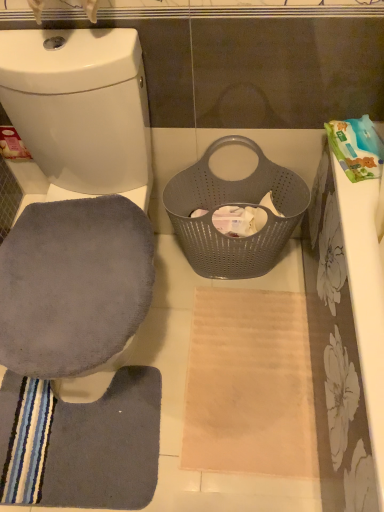
In order to click on empty space that is ontop of gray suede swivel chair at left (from a real-world perspective) in this screenshot , I will do `click(64, 273)`.